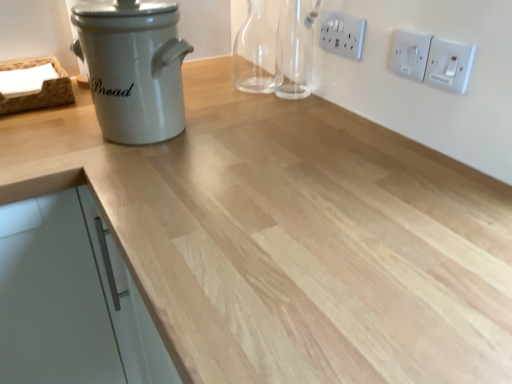
Measure the distance between wooden tray at left and camera.

wooden tray at left and camera are 39.29 inches apart.

What do you see at coordinates (409, 53) in the screenshot? This screenshot has height=384, width=512. I see `white plastic switch at upper right, placed as the second electric outlet when sorted from left to right` at bounding box center [409, 53].

Identify the location of white plastic switch at upper right, which is the third electric outlet from back to front. This screenshot has width=512, height=384. (449, 64).

This screenshot has width=512, height=384. I want to click on white ceramic bread bin at left, so click(133, 68).

The height and width of the screenshot is (384, 512). Describe the element at coordinates (257, 48) in the screenshot. I see `transparent glass bottle at upper center` at that location.

This screenshot has height=384, width=512. I want to click on wooden tray at left, so click(x=41, y=88).

Is the surface of white plastic switch at upper right, placed as the second electric outlet when sorted from left to right, in direct contact with white plastic switch at upper right, which is the third electric outlet in left-to-right order?

Yes, the surface of white plastic switch at upper right, placed as the second electric outlet when sorted from left to right, is in contact with white plastic switch at upper right, which is the third electric outlet in left-to-right order.

Is white plastic switch at upper right, placed as the second electric outlet when sorted from left to right, to the left or to the right of white plastic switch at upper right, which ranks as the 1th electric outlet in right-to-left order, in the image?

Based on their positions, white plastic switch at upper right, placed as the second electric outlet when sorted from left to right, is located to the left of white plastic switch at upper right, which ranks as the 1th electric outlet in right-to-left order.

Between white plastic switch at upper right, the 2th electric outlet when ordered from right to left, and white plastic switch at upper right, marked as the 1th electric outlet in a front-to-back arrangement, which one is positioned behind?

white plastic switch at upper right, the 2th electric outlet when ordered from right to left, is more distant.

How many degrees apart are the facing directions of white plastic electric outlet at upper right, which is the 1th electric outlet from back to front, and white ceramic bread bin at left?

The angle between the facing direction of white plastic electric outlet at upper right, which is the 1th electric outlet from back to front, and the facing direction of white ceramic bread bin at left is 90.1 degrees.

Can we say white plastic electric outlet at upper right, which is the 1th electric outlet from back to front, lies outside white ceramic bread bin at left?

Yes, white plastic electric outlet at upper right, which is the 1th electric outlet from back to front, is not within white ceramic bread bin at left.

Considering the points (323, 37) and (170, 103), which point is in front, point (323, 37) or point (170, 103)?

The point (170, 103) is more forward.

Is white plastic electric outlet at upper right, which is counted as the third electric outlet, starting from the right, not close to white ceramic bread bin at left?

That's not correct — white plastic electric outlet at upper right, which is counted as the third electric outlet, starting from the right, is a little close to white ceramic bread bin at left.

Is white matte cabinet handle at left not near white plastic electric outlet at upper right, positioned as the third electric outlet in front-to-back order?

No, white matte cabinet handle at left is not far away from white plastic electric outlet at upper right, positioned as the third electric outlet in front-to-back order.

Can white plastic electric outlet at upper right, positioned as the first electric outlet in left-to-right order, be found inside white matte cabinet handle at left?

Definitely not — white plastic electric outlet at upper right, positioned as the first electric outlet in left-to-right order, is not inside white matte cabinet handle at left.

Between white matte cabinet handle at left and white plastic electric outlet at upper right, positioned as the first electric outlet in left-to-right order, which one has larger width?

white matte cabinet handle at left.

Can you confirm if white matte cabinet handle at left is bigger than white plastic electric outlet at upper right, which is counted as the third electric outlet, starting from the right?

Indeed, white matte cabinet handle at left has a larger size compared to white plastic electric outlet at upper right, which is counted as the third electric outlet, starting from the right.

Image resolution: width=512 pixels, height=384 pixels. In order to click on the 1st electric outlet positioned above the white matte cabinet handle at left (from the image's perspective) in this screenshot , I will do `click(449, 64)`.

Is white matte cabinet handle at left located outside white plastic switch at upper right, which ranks as the 1th electric outlet in right-to-left order?

That's correct, white matte cabinet handle at left is outside of white plastic switch at upper right, which ranks as the 1th electric outlet in right-to-left order.

From a real-world perspective, relative to white plastic switch at upper right, which is the third electric outlet in left-to-right order, is white matte cabinet handle at left vertically above or below?

white matte cabinet handle at left is situated lower than white plastic switch at upper right, which is the third electric outlet in left-to-right order, in the real world.

Is white matte cabinet handle at left in contact with white plastic switch at upper right, which ranks as the 1th electric outlet in right-to-left order?

No, white matte cabinet handle at left is not in contact with white plastic switch at upper right, which ranks as the 1th electric outlet in right-to-left order.

Does white plastic switch at upper right, which is the third electric outlet in left-to-right order, contain white matte cabinet handle at left?

Actually, white matte cabinet handle at left is outside white plastic switch at upper right, which is the third electric outlet in left-to-right order.

How different are the orientations of white plastic switch at upper right, marked as the 1th electric outlet in a front-to-back arrangement, and white matte cabinet handle at left in degrees?

89.5 degrees separate the facing orientations of white plastic switch at upper right, marked as the 1th electric outlet in a front-to-back arrangement, and white matte cabinet handle at left.

There is a white matte cabinet handle at left. Where is `the 2nd electric outlet above it (from a real-world perspective)`? The image size is (512, 384). the 2nd electric outlet above it (from a real-world perspective) is located at coordinates (449, 64).

Which point is more distant from viewer, [445,50] or [106,362]?

The point [106,362] is behind.

Can you confirm if white plastic electric outlet at upper right, positioned as the third electric outlet in front-to-back order, is positioned to the right of wooden tray at left?

Correct, you'll find white plastic electric outlet at upper right, positioned as the third electric outlet in front-to-back order, to the right of wooden tray at left.

Where is `basket in front of the white plastic electric outlet at upper right, which is the 1th electric outlet from back to front`? basket in front of the white plastic electric outlet at upper right, which is the 1th electric outlet from back to front is located at coordinates (41, 88).

What's the angular difference between white plastic electric outlet at upper right, positioned as the first electric outlet in left-to-right order, and wooden tray at left's facing directions?

The angle between the facing direction of white plastic electric outlet at upper right, positioned as the first electric outlet in left-to-right order, and the facing direction of wooden tray at left is 90.1 degrees.

Are white ceramic bread bin at left and white plastic electric outlet at upper right, which is counted as the third electric outlet, starting from the right, making contact?

No, white ceramic bread bin at left is not making contact with white plastic electric outlet at upper right, which is counted as the third electric outlet, starting from the right.

Is white ceramic bread bin at left facing towards white plastic electric outlet at upper right, positioned as the third electric outlet in front-to-back order?

No, white ceramic bread bin at left is not oriented towards white plastic electric outlet at upper right, positioned as the third electric outlet in front-to-back order.

Is white ceramic bread bin at left bigger than white plastic electric outlet at upper right, which is the 1th electric outlet from back to front?

Yes.

Would you say white ceramic bread bin at left contains white plastic electric outlet at upper right, which is counted as the third electric outlet, starting from the right?

Definitely not — white plastic electric outlet at upper right, which is counted as the third electric outlet, starting from the right, is not inside white ceramic bread bin at left.

At what (x,y) coordinates should I click in order to perform the action: click on electric outlet that is in front of the white plastic switch at upper right, which is the second electric outlet from front to back. Please return your answer as a coordinate pair (x, y). Image resolution: width=512 pixels, height=384 pixels. Looking at the image, I should click on (449, 64).

Find the location of a particular element. Image resolution: width=512 pixels, height=384 pixels. kitchen appliance on the left of white plastic electric outlet at upper right, which is the 1th electric outlet from back to front is located at coordinates (133, 68).

When comparing their distances from transparent glass bottle at upper center, does white ceramic bread bin at left or white plastic switch at upper right, which is the third electric outlet from back to front, seem further?

white plastic switch at upper right, which is the third electric outlet from back to front.

Considering their positions, is white plastic electric outlet at upper right, which is the 1th electric outlet from back to front, positioned further to wooden tray at left than white matte cabinet handle at left?

The object further to wooden tray at left is white plastic electric outlet at upper right, which is the 1th electric outlet from back to front.

Which object lies further to the anchor point wooden tray at left, white plastic switch at upper right, placed as the second electric outlet when sorted from left to right, or transparent glass bottle at upper center?

Among the two, white plastic switch at upper right, placed as the second electric outlet when sorted from left to right, is located further to wooden tray at left.

Which object lies further to the anchor point white ceramic bread bin at left, white matte cabinet handle at left or white plastic electric outlet at upper right, positioned as the first electric outlet in left-to-right order?

The object further to white ceramic bread bin at left is white plastic electric outlet at upper right, positioned as the first electric outlet in left-to-right order.

From the image, which object appears to be farther from white plastic electric outlet at upper right, positioned as the first electric outlet in left-to-right order, white plastic switch at upper right, marked as the 1th electric outlet in a front-to-back arrangement, or wooden tray at left?

wooden tray at left is positioned further to the anchor white plastic electric outlet at upper right, positioned as the first electric outlet in left-to-right order.

When comparing their distances from white ceramic bread bin at left, does transparent glass bottle at upper center or white matte cabinet handle at left seem closer?

The object closer to white ceramic bread bin at left is white matte cabinet handle at left.

Based on their spatial positions, is wooden tray at left or white ceramic bread bin at left further from white matte cabinet handle at left?

Based on the image, wooden tray at left appears to be further to white matte cabinet handle at left.

Which object lies nearer to the anchor point white plastic switch at upper right, which ranks as the 1th electric outlet in right-to-left order, white matte cabinet handle at left or transparent glass bottle at upper center?

Based on the image, transparent glass bottle at upper center appears to be nearer to white plastic switch at upper right, which ranks as the 1th electric outlet in right-to-left order.

Locate an element on the screen. This screenshot has width=512, height=384. bottle located between wooden tray at left and white plastic switch at upper right, placed as the second electric outlet when sorted from left to right, in the left-right direction is located at coordinates (257, 48).

Locate an element on the screen. The height and width of the screenshot is (384, 512). electric outlet between white ceramic bread bin at left and white plastic switch at upper right, the 2th electric outlet when ordered from right to left, from left to right is located at coordinates coord(342,34).

Where is `basket that lies between transparent glass bottle at upper center and white matte cabinet handle at left from top to bottom`? Image resolution: width=512 pixels, height=384 pixels. basket that lies between transparent glass bottle at upper center and white matte cabinet handle at left from top to bottom is located at coordinates (41, 88).

You are a GUI agent. You are given a task and a screenshot of the screen. Output one action in this format:
    pyautogui.click(x=<x>, y=<y>)
    Task: Click on the bottle situated between white matte cabinet handle at left and white plastic switch at upper right, which is counted as the 2th electric outlet, starting from the back, from left to right
    The image size is (512, 384).
    Given the screenshot: What is the action you would take?
    pyautogui.click(x=257, y=48)